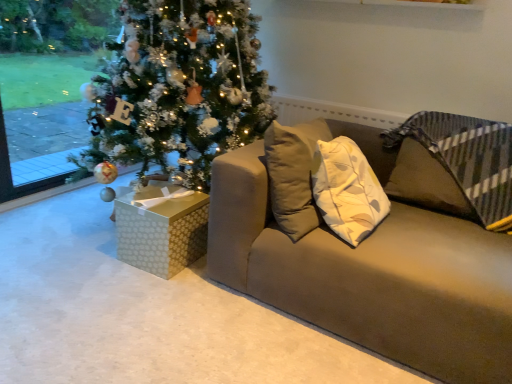
Question: Is matte brown couch at center wider or thinner than gold-patterned gift box at lower left?

Choices:
 (A) thin
 (B) wide

Answer: (B)

Question: Is matte brown couch at center inside the boundaries of gold-patterned gift box at lower left, or outside?

Choices:
 (A) inside
 (B) outside

Answer: (B)

Question: From their relative heights in the image, would you say matte brown couch at center is taller or shorter than gold-patterned gift box at lower left?

Choices:
 (A) short
 (B) tall

Answer: (B)

Question: From the image's perspective, is gold-patterned gift box at lower left above or below matte brown couch at center?

Choices:
 (A) below
 (B) above

Answer: (A)

Question: Is gold-patterned gift box at lower left in front of or behind matte brown couch at center in the image?

Choices:
 (A) behind
 (B) front

Answer: (A)

Question: Looking at their shapes, would you say gold-patterned gift box at lower left is wider or thinner than matte brown couch at center?

Choices:
 (A) wide
 (B) thin

Answer: (B)

Question: Does point (198, 236) appear closer or farther from the camera than point (366, 314)?

Choices:
 (A) closer
 (B) farther

Answer: (B)